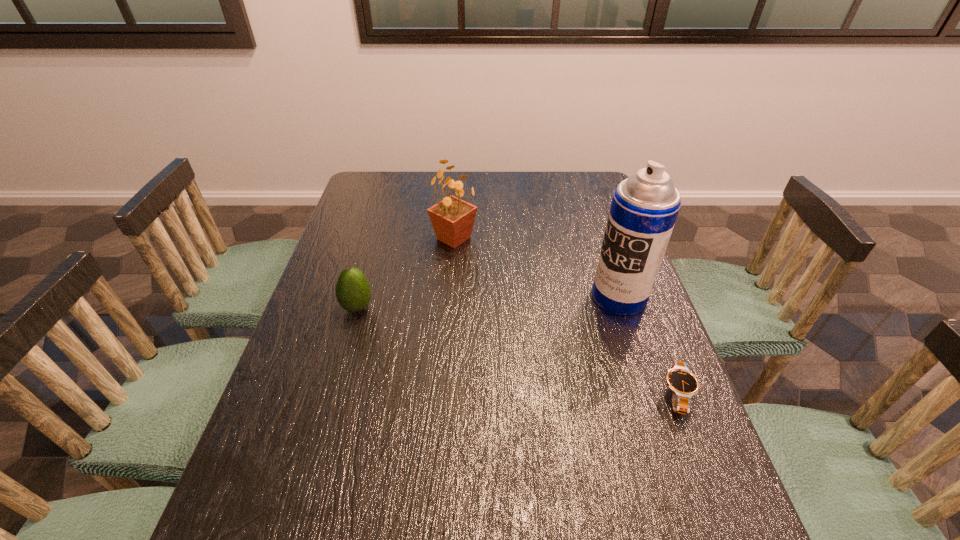
Identify the location of free region located 0.230m at the front of the third shortest object with flowers visible. pos(459,308).

Find the location of a particular element. The height and width of the screenshot is (540, 960). free spot located at the front of the third shortest object with flowers visible is located at coordinates (461, 335).

You are a GUI agent. You are given a task and a screenshot of the screen. Output one action in this format:
    pyautogui.click(x=<x>, y=<y>)
    Task: Click on the vacant space located on the label side of the tallest object
    This screenshot has height=540, width=960.
    Given the screenshot: What is the action you would take?
    pyautogui.click(x=565, y=323)

Identify the location of vacant region located 0.350m on the label side of the tallest object. The image size is (960, 540). (484, 362).

I want to click on vacant space located on the label side of the tallest object, so click(488, 360).

Identify the location of object that is at the left edge. (353, 292).

The image size is (960, 540). What are the coordinates of `watch located at the right edge` in the screenshot? It's located at (683, 384).

Identify the location of aerosol can that is at the right edge. Image resolution: width=960 pixels, height=540 pixels. (644, 208).

You are a GUI agent. You are given a task and a screenshot of the screen. Output one action in this format:
    pyautogui.click(x=<x>, y=<y>)
    Task: Click on the vacant space at the far edge of the desktop
    
    Given the screenshot: What is the action you would take?
    pyautogui.click(x=502, y=180)

The height and width of the screenshot is (540, 960). Find the location of `vacant region at the left edge`. vacant region at the left edge is located at coordinates (305, 316).